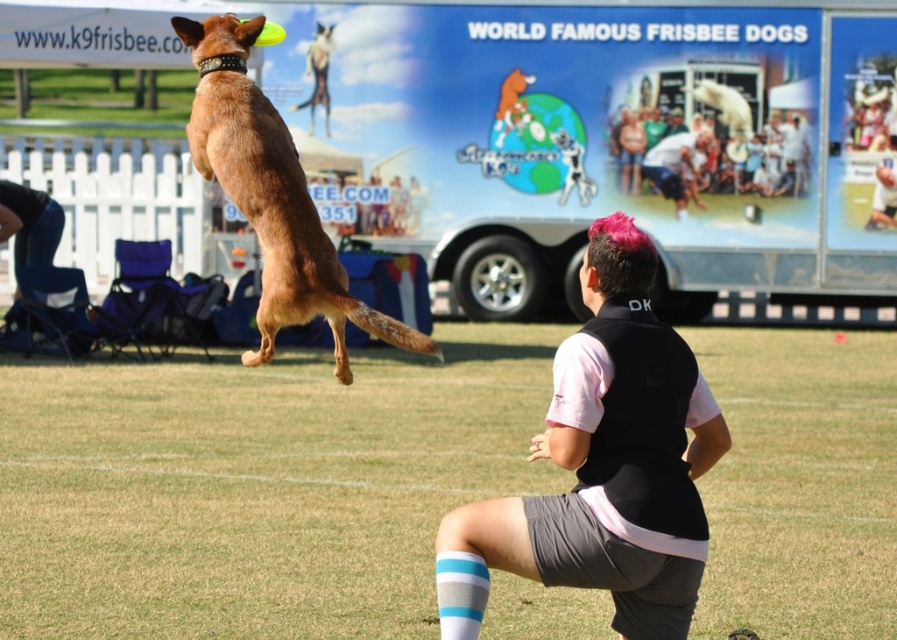
Question: Which point is farther from the camera taking this photo?

Choices:
 (A) (659, 330)
 (B) (241, 60)

Answer: (B)

Question: Can you confirm if pink hair at center is bigger than brown matte dog at upper left?

Choices:
 (A) no
 (B) yes

Answer: (A)

Question: In this image, where is pink hair at center located relative to brown matte dog at upper left?

Choices:
 (A) above
 (B) below

Answer: (B)

Question: Which of the following is the closest to the observer?

Choices:
 (A) (231, 17)
 (B) (623, 352)

Answer: (B)

Question: Does pink hair at center have a smaller size compared to brown matte dog at upper left?

Choices:
 (A) no
 (B) yes

Answer: (B)

Question: Which of the following is the farthest from the observer?

Choices:
 (A) tap(663, 384)
 (B) tap(208, 35)

Answer: (B)